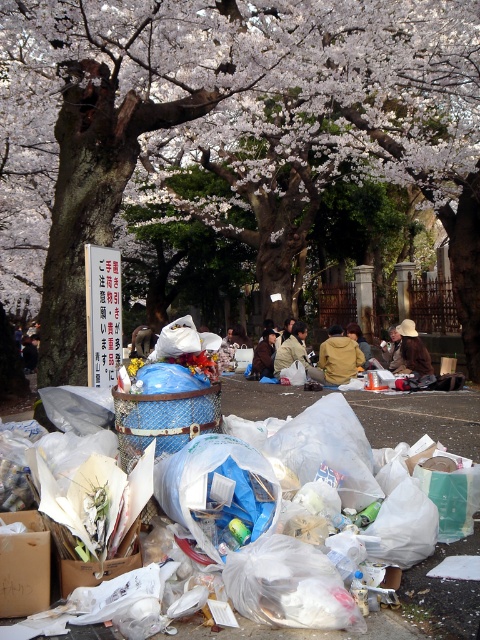
You are a park visitor who wants to pick up the brown fabric jacket at center. However, you notice the clear plastic bags at center in the way. Can you reach the jacket without moving the plastic bags?

The clear plastic bags at center are located below the brown fabric jacket at center, so you can reach the jacket without moving the plastic bags.